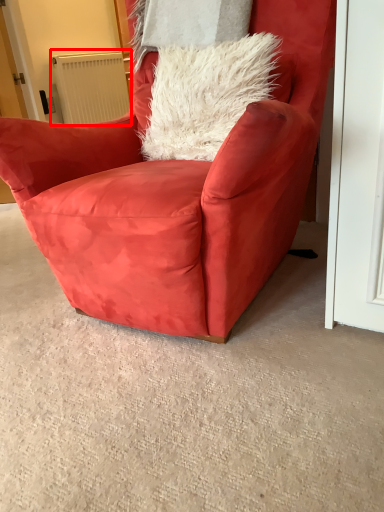
Question: From the image's perspective, where is radiator (annotated by the red box) located in relation to chair in the image?

Choices:
 (A) above
 (B) below

Answer: (A)